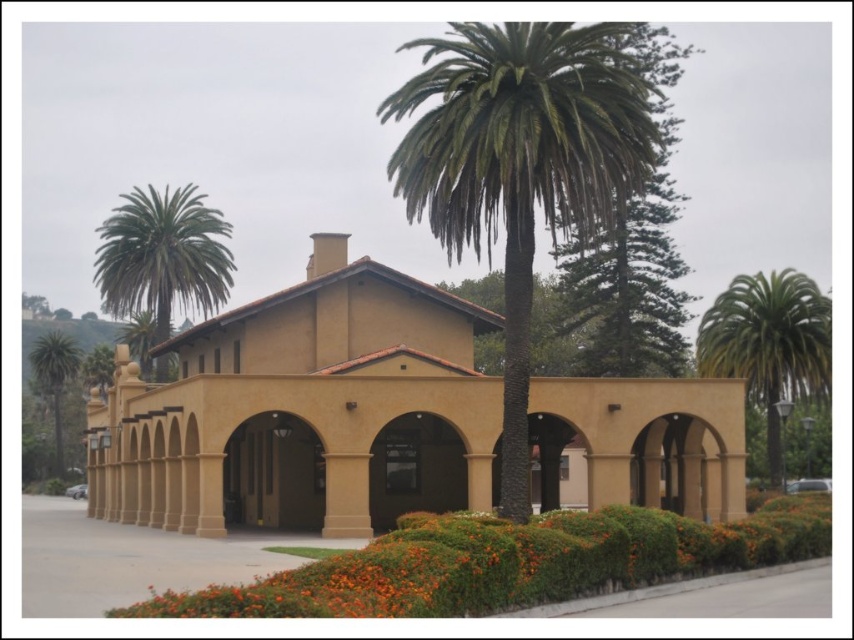
At what (x,y) coordinates should I click in order to perform the action: click on green leafy palm tree at left. Please return your answer as a coordinate pair (x, y). Image resolution: width=854 pixels, height=640 pixels. Looking at the image, I should click on (54, 376).

Can you confirm if green leafy palm tree at left is positioned to the right of green leafy palm tree at upper center?

No, green leafy palm tree at left is not to the right of green leafy palm tree at upper center.

Is point (56, 380) in front of point (136, 342)?

That is False.

This screenshot has width=854, height=640. What are the coordinates of `green leafy palm tree at left` in the screenshot? It's located at (54, 376).

Between green leafy palm tree at center and green leafy palm tree at left, which one has more height?

green leafy palm tree at center

Does green leafy palm tree at center appear over green leafy palm tree at left?

Indeed, green leafy palm tree at center is positioned over green leafy palm tree at left.

Find the location of `green leafy palm tree at center`. green leafy palm tree at center is located at coordinates (519, 163).

Is green leafy palm tree at upper left shorter than green leafy palm tree at upper center?

In fact, green leafy palm tree at upper left may be taller than green leafy palm tree at upper center.

Does green leafy palm tree at upper left have a greater height compared to green leafy palm tree at upper center?

Correct, green leafy palm tree at upper left is much taller as green leafy palm tree at upper center.

Identify the location of green leafy palm tree at upper left. (162, 256).